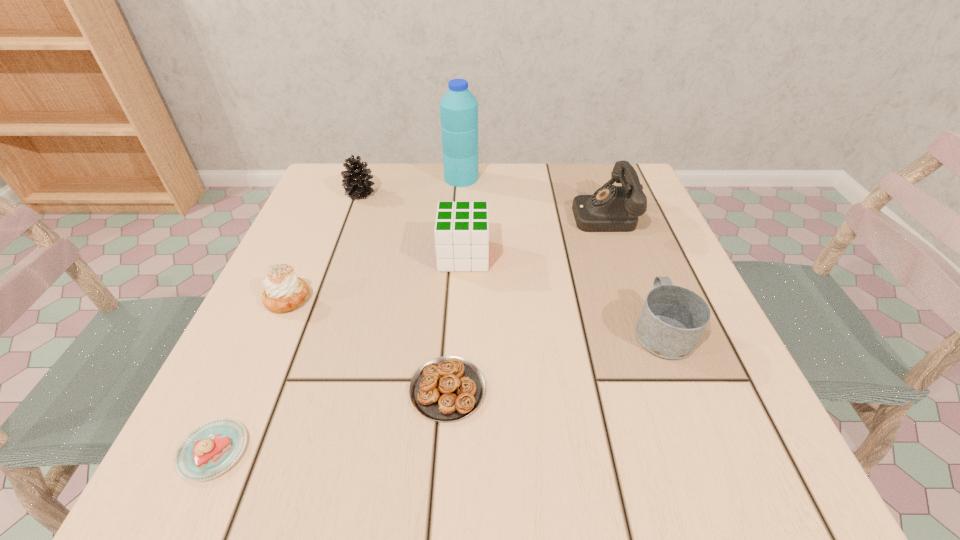
Find the location of a particular element. vacant area that lies between the rightmost pastry and the tallest pastry is located at coordinates (368, 345).

In order to click on blank region between the mug and the farthest pastry in this screenshot , I will do `click(474, 314)`.

Where is `free spot between the mug and the water bottle`? Image resolution: width=960 pixels, height=540 pixels. free spot between the mug and the water bottle is located at coordinates (562, 254).

The width and height of the screenshot is (960, 540). What are the coordinates of `object that is the closest to the telephone` in the screenshot? It's located at (673, 319).

Find the location of `the fourth closest object to the mug`. the fourth closest object to the mug is located at coordinates (458, 108).

Locate an element on the screen. the second closest pastry to the telephone is located at coordinates click(x=284, y=291).

Where is `the third closest pastry to the cube`? the third closest pastry to the cube is located at coordinates (212, 448).

Locate an element on the screen. Image resolution: width=960 pixels, height=540 pixels. free space that satisfies the following two spatial constraints: 1. on the dial of the telephone; 2. on the side of the mug with the handle is located at coordinates (642, 329).

You are a GUI agent. You are given a task and a screenshot of the screen. Output one action in this format:
    pyautogui.click(x=<x>, y=<y>)
    Task: Click on the vacant point that satisfies the following two spatial constraints: 1. on the front side of the rightmost pastry; 2. on the left side of the tallest pastry
    
    Given the screenshot: What is the action you would take?
    pyautogui.click(x=248, y=389)

At what (x,y) coordinates should I click in order to perform the action: click on free space that satisfies the following two spatial constraints: 1. on the red face of the cube; 2. on the front side of the tallest pastry. Please return your answer as a coordinate pair (x, y). Looking at the image, I should click on (462, 299).